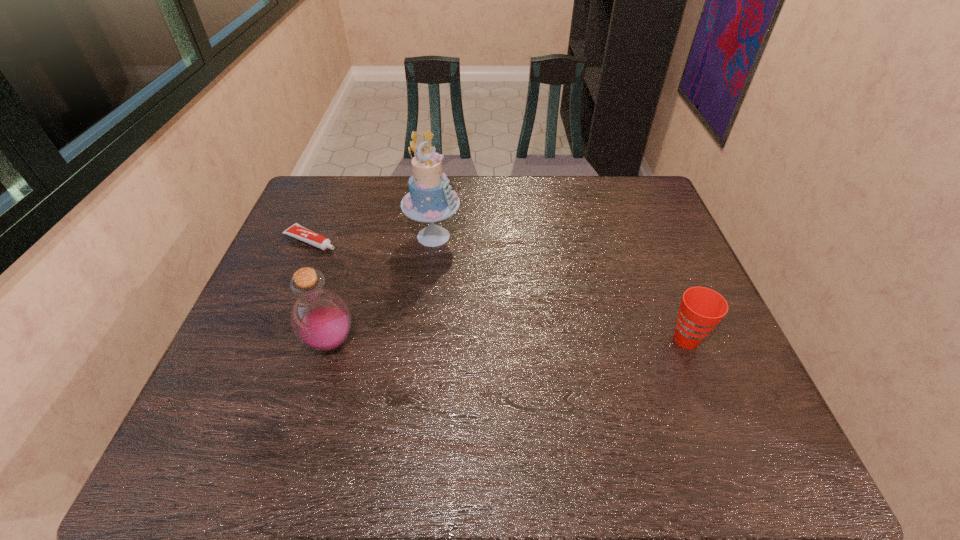
Locate an element on the screen. This screenshot has width=960, height=540. free spot on the desktop that is between the second tallest object and the cup and is positioned with a ladder on the side of the tallest object is located at coordinates (535, 341).

The image size is (960, 540). Identify the location of vacant space on the desktop that is between the second tallest object and the rightmost object and is positioned at the nozzle of the toothpaste. (528, 341).